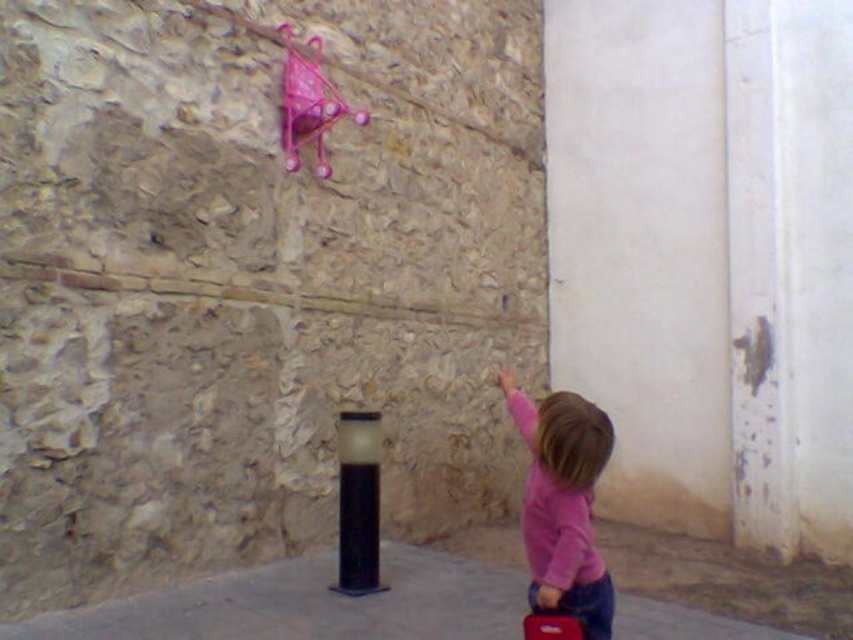
Which is behind, point (587, 518) or point (546, 632)?

The point (587, 518) is more distant.

Is point (573, 602) behind point (523, 628)?

No, (573, 602) is in front of (523, 628).

Who is more distant from viewer, (585,481) or (543,620)?

Point (543,620)

Find the location of a particular element. The image size is (853, 640). pink matte shirt at center is located at coordinates (563, 502).

Is point (207, 634) more distant than point (360, 502)?

No, (207, 634) is in front of (360, 502).

Is gray concrete pavement at center shorter than black matte pole at center?

Indeed, gray concrete pavement at center has a lesser height compared to black matte pole at center.

Describe the element at coordinates (308, 604) in the screenshot. The height and width of the screenshot is (640, 853). I see `gray concrete pavement at center` at that location.

In order to click on gray concrete pavement at center in this screenshot , I will do pos(308,604).

Which of these two, gray concrete pavement at center or pink matte shirt at center, stands taller?

pink matte shirt at center is taller.

Is point (427, 588) positioned after point (587, 472)?

Yes, point (427, 588) is farther from viewer.

Identify the location of gray concrete pavement at center. (308, 604).